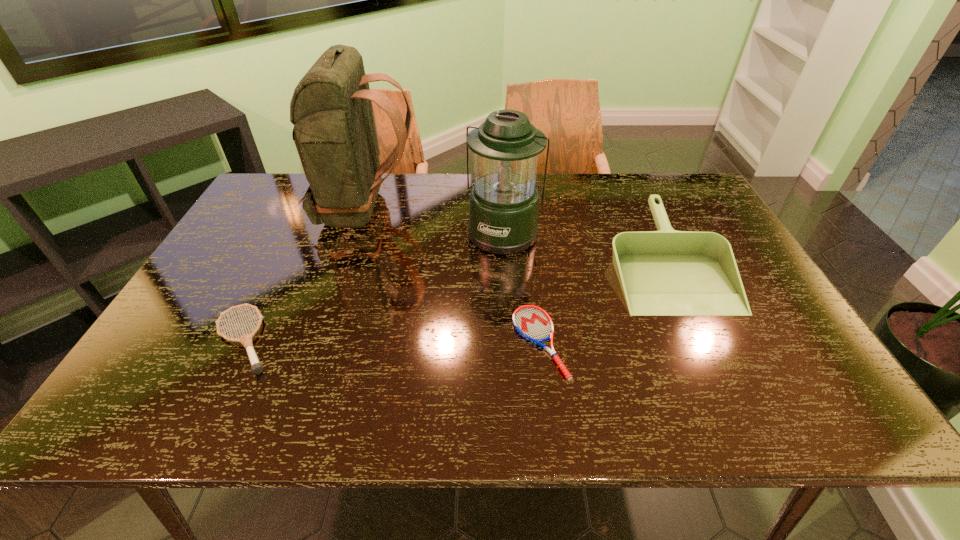
This screenshot has height=540, width=960. What are the coordinates of `backpack` in the screenshot? It's located at (334, 131).

I want to click on the fourth shortest object, so click(x=504, y=203).

In order to click on the third shortest object in this screenshot , I will do `click(666, 272)`.

Locate an element on the screen. The image size is (960, 540). dustpan is located at coordinates (666, 272).

At what (x,y) coordinates should I click in order to perform the action: click on the second shortest object. Please return your answer as a coordinate pair (x, y). Image resolution: width=960 pixels, height=540 pixels. Looking at the image, I should click on (246, 340).

This screenshot has height=540, width=960. I want to click on the taller tennis racket, so click(x=246, y=340).

At what (x,y) coordinates should I click in order to perform the action: click on the shorter tennis racket. Please return your answer as a coordinate pair (x, y). The width and height of the screenshot is (960, 540). Looking at the image, I should click on point(533,323).

I want to click on the shortest object, so click(533, 323).

Locate an element on the screen. The image size is (960, 540). vacant region located on the back of the tallest object is located at coordinates (545, 209).

Where is `vacant space located 0.180m on the front of the second tallest object`? vacant space located 0.180m on the front of the second tallest object is located at coordinates (509, 303).